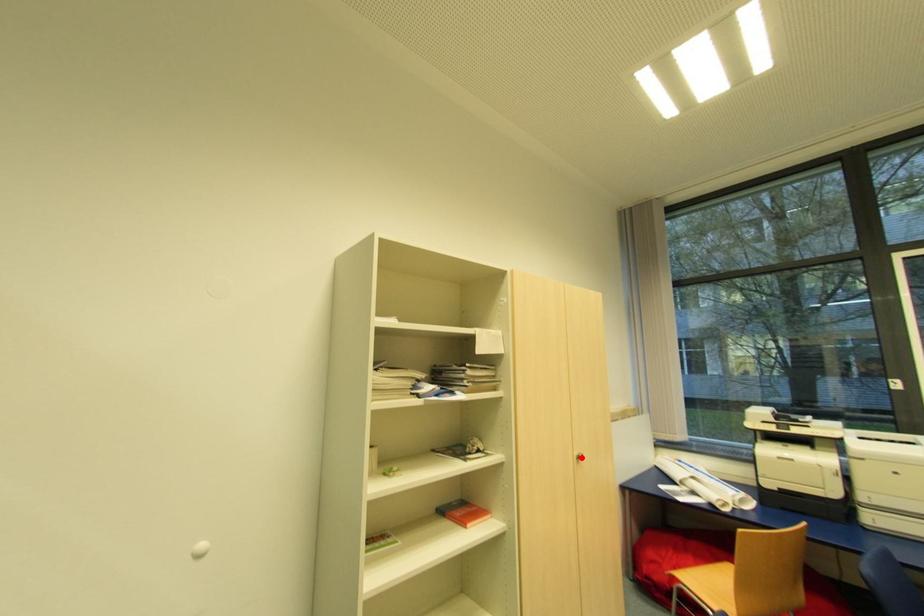
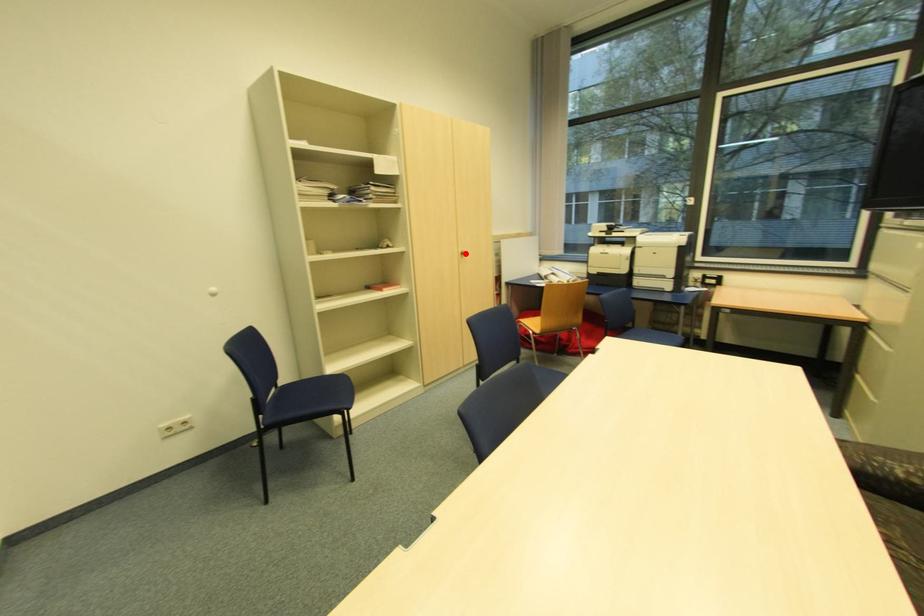
I am providing you with two images of the same scene from different viewpoints. A red point is marked on the first image and another point is marked on the second image. Do the highlighted points in image1 and image2 indicate the same real-world spot?

Yes